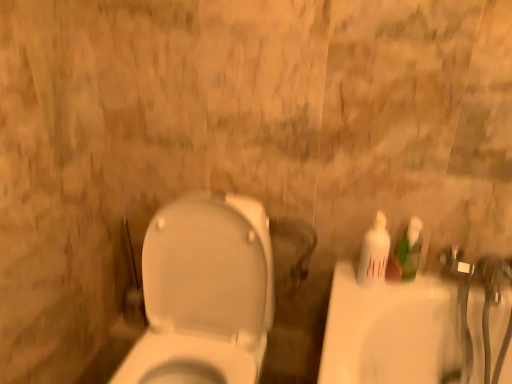
Question: From the image's perspective, is white glossy toilet at center on green plastic bottle at right, which appears as the second mouthwash when viewed from the left?

Choices:
 (A) no
 (B) yes

Answer: (A)

Question: Is white glossy toilet at center not near green plastic bottle at right, marked as the 1th mouthwash in a right-to-left arrangement?

Choices:
 (A) yes
 (B) no

Answer: (B)

Question: Is white glossy toilet at center located outside green plastic bottle at right, marked as the 1th mouthwash in a right-to-left arrangement?

Choices:
 (A) yes
 (B) no

Answer: (A)

Question: Is white glossy toilet at center wider than green plastic bottle at right, marked as the 1th mouthwash in a right-to-left arrangement?

Choices:
 (A) yes
 (B) no

Answer: (A)

Question: From the image's perspective, is white glossy toilet at center below green plastic bottle at right, which appears as the second mouthwash when viewed from the left?

Choices:
 (A) no
 (B) yes

Answer: (B)

Question: From a real-world perspective, is white glossy toilet at center on top of green plastic bottle at right, marked as the 1th mouthwash in a right-to-left arrangement?

Choices:
 (A) no
 (B) yes

Answer: (A)

Question: Is green plastic bottle at right, marked as the 1th mouthwash in a right-to-left arrangement, not near white glossy bottle at right, acting as the first mouthwash starting from the left?

Choices:
 (A) no
 (B) yes

Answer: (A)

Question: Is green plastic bottle at right, which appears as the second mouthwash when viewed from the left, closer to the viewer compared to white glossy bottle at right, acting as the first mouthwash starting from the left?

Choices:
 (A) no
 (B) yes

Answer: (A)

Question: Is white glossy bottle at right, acting as the first mouthwash starting from the left, surrounded by green plastic bottle at right, which appears as the second mouthwash when viewed from the left?

Choices:
 (A) no
 (B) yes

Answer: (A)

Question: Is green plastic bottle at right, which appears as the second mouthwash when viewed from the left, facing away from white glossy bottle at right, arranged as the second mouthwash when viewed from the right?

Choices:
 (A) no
 (B) yes

Answer: (A)

Question: Can you confirm if green plastic bottle at right, which appears as the second mouthwash when viewed from the left, is taller than white glossy bottle at right, arranged as the second mouthwash when viewed from the right?

Choices:
 (A) no
 (B) yes

Answer: (A)

Question: Does green plastic bottle at right, marked as the 1th mouthwash in a right-to-left arrangement, appear on the right side of white glossy bottle at right, arranged as the second mouthwash when viewed from the right?

Choices:
 (A) no
 (B) yes

Answer: (B)

Question: Would you say white glossy toilet at center is a long distance from white glossy bottle at right, arranged as the second mouthwash when viewed from the right?

Choices:
 (A) no
 (B) yes

Answer: (A)